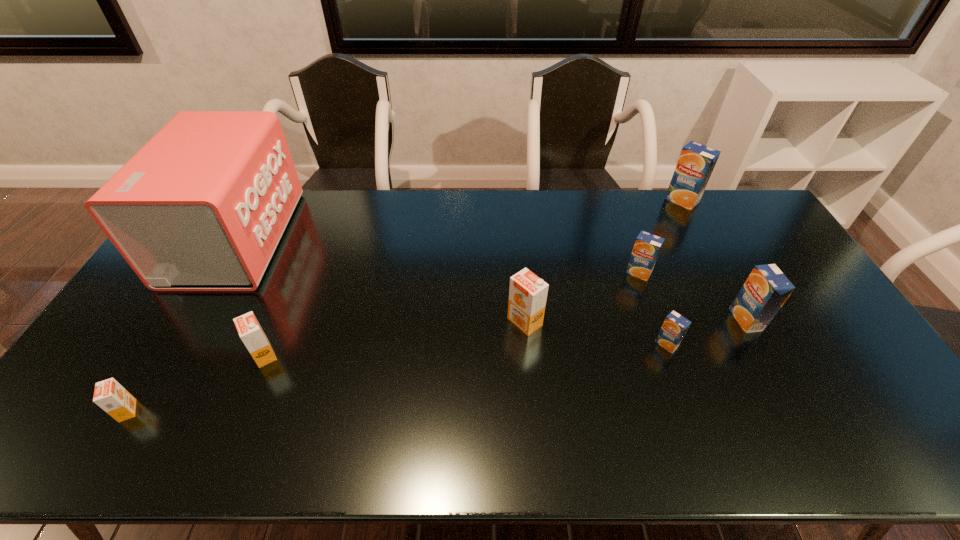
Where is `the tallest object`? This screenshot has height=540, width=960. the tallest object is located at coordinates (202, 206).

The height and width of the screenshot is (540, 960). In order to click on pink box in this screenshot , I will do `click(202, 206)`.

Locate an element on the screen. This screenshot has width=960, height=540. the second tallest object is located at coordinates (696, 162).

Locate an element on the screen. This screenshot has height=540, width=960. the farthest orange juice is located at coordinates (696, 162).

The width and height of the screenshot is (960, 540). I want to click on the third smallest blue orange_juice, so pos(766,289).

At what (x,y) coordinates should I click in order to perform the action: click on the biggest orange orange juice. Please return your answer as a coordinate pair (x, y). The height and width of the screenshot is (540, 960). Looking at the image, I should click on (527, 293).

The width and height of the screenshot is (960, 540). In order to click on the farthest orange orange juice in this screenshot , I will do `click(527, 293)`.

Where is `the second smallest blue orange_juice`? This screenshot has height=540, width=960. the second smallest blue orange_juice is located at coordinates (647, 246).

Locate an element on the screen. This screenshot has height=540, width=960. the third nearest blue orange_juice is located at coordinates (647, 246).

What are the coordinates of `the sixth object from right to left` in the screenshot? It's located at coord(249,329).